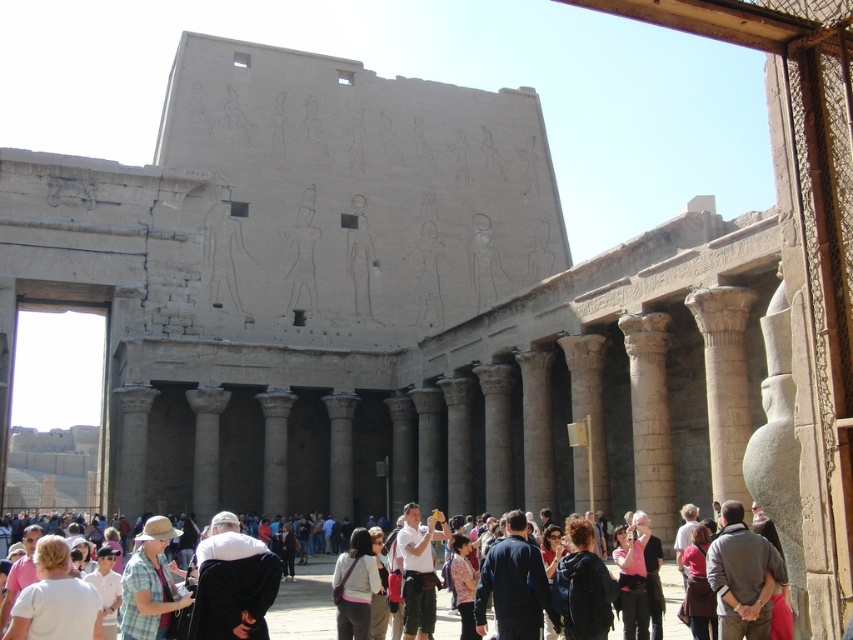
Does white fabric at center appear on the right side of matte black jacket at lower center?

No, white fabric at center is not to the right of matte black jacket at lower center.

Is white fabric at center below matte black jacket at lower center?

No, white fabric at center is not below matte black jacket at lower center.

Locate an element on the screen. white fabric at center is located at coordinates (55, 600).

Can you confirm if dark gray fabric backpack at center is positioned to the right of matte black jacket at lower center?

Incorrect, dark gray fabric backpack at center is not on the right side of matte black jacket at lower center.

Between dark gray fabric backpack at center and matte black jacket at lower center, which one is positioned lower?

dark gray fabric backpack at center is lower down.

Find the location of `dark gray fabric backpack at center`. dark gray fabric backpack at center is located at coordinates (355, 586).

Is white fabric at center positioned at the back of matte pink shirt at center?

That is False.

The width and height of the screenshot is (853, 640). I want to click on white fabric at center, so click(55, 600).

The width and height of the screenshot is (853, 640). I want to click on white fabric at center, so click(x=55, y=600).